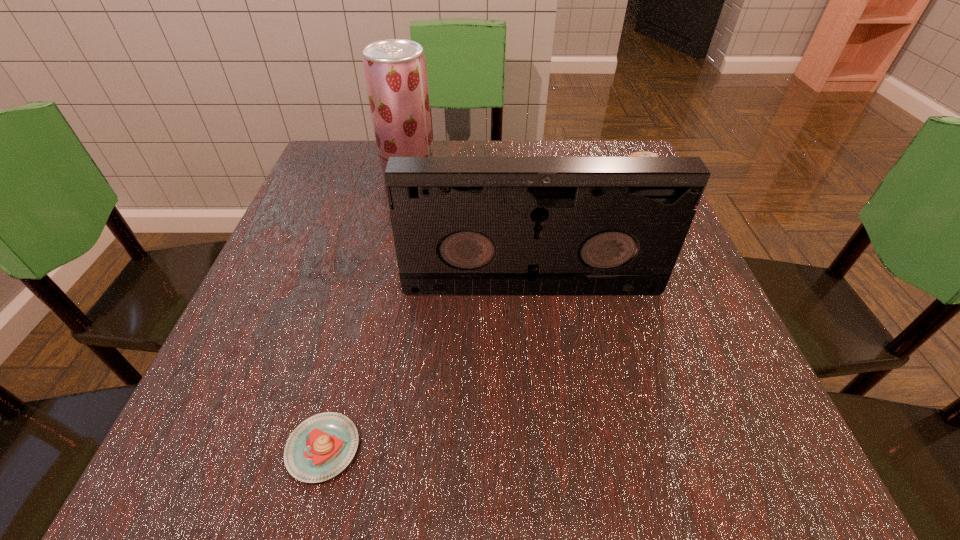
Find the location of `free space located 0.230m on the back of the nearer pastry`. free space located 0.230m on the back of the nearer pastry is located at coordinates (363, 291).

The width and height of the screenshot is (960, 540). In order to click on fruit juice situated at the far edge in this screenshot , I will do `click(395, 70)`.

Find the location of `pastry located in the far edge section of the desktop`. pastry located in the far edge section of the desktop is located at coordinates (638, 154).

This screenshot has width=960, height=540. Find the location of `object located in the near edge section of the desktop`. object located in the near edge section of the desktop is located at coordinates (322, 446).

This screenshot has height=540, width=960. Find the location of `object that is at the left edge`. object that is at the left edge is located at coordinates (322, 446).

I want to click on videotape present at the right edge, so click(x=461, y=225).

This screenshot has width=960, height=540. In order to click on pastry located in the right edge section of the desktop in this screenshot , I will do `click(638, 154)`.

At what (x,y) coordinates should I click in order to perform the action: click on object positioned at the near left corner. Please return your answer as a coordinate pair (x, y). This screenshot has height=540, width=960. Looking at the image, I should click on (322, 446).

At what (x,y) coordinates should I click in order to perform the action: click on object that is at the far right corner. Please return your answer as a coordinate pair (x, y). The image size is (960, 540). Looking at the image, I should click on (638, 154).

You are a GUI agent. You are given a task and a screenshot of the screen. Output one action in this format:
    pyautogui.click(x=<x>, y=<y>)
    Task: Click on the free location at the far edge of the desktop
    The height and width of the screenshot is (540, 960).
    Given the screenshot: What is the action you would take?
    pyautogui.click(x=468, y=151)